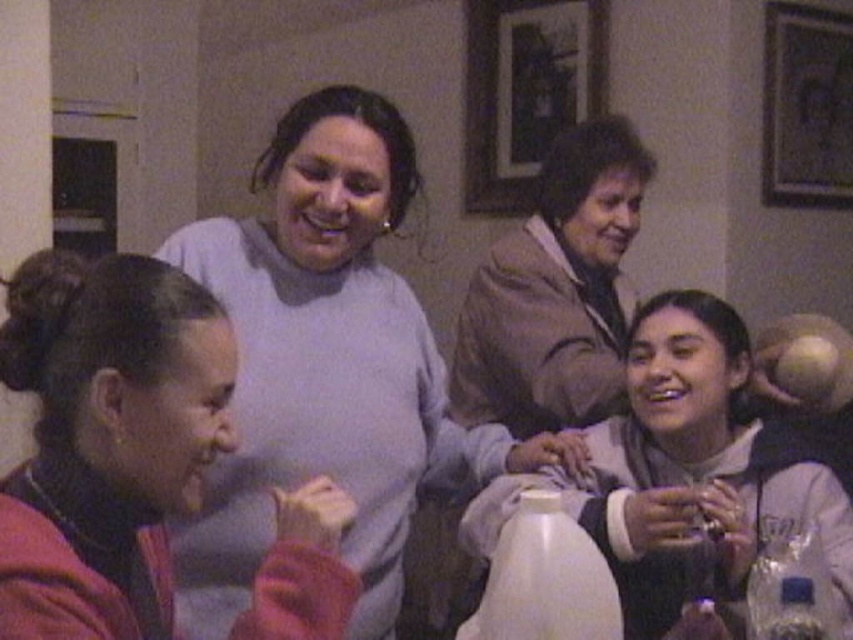
Question: Which object appears closest to the camera in this image?

Choices:
 (A) wooden picture frame at upper center
 (B) white glossy bottle at lower center

Answer: (B)

Question: Which point is closer to the camera?

Choices:
 (A) (837, 104)
 (B) (71, 385)

Answer: (B)

Question: Estimate the real-world distances between objects in this image. Which object is closer to the white glossy bottle at lower center?

Choices:
 (A) wooden picture frame at upper right
 (B) wooden picture frame at upper center
 (C) light gray sweater at upper center

Answer: (C)

Question: Is wooden picture frame at upper center bigger than white glossy bottle at lower center?

Choices:
 (A) no
 (B) yes

Answer: (B)

Question: Does wooden picture frame at upper center come in front of white glossy bottle at lower center?

Choices:
 (A) yes
 (B) no

Answer: (B)

Question: Can you confirm if matte pink hoodie at lower left is wider than wooden picture frame at upper center?

Choices:
 (A) no
 (B) yes

Answer: (A)